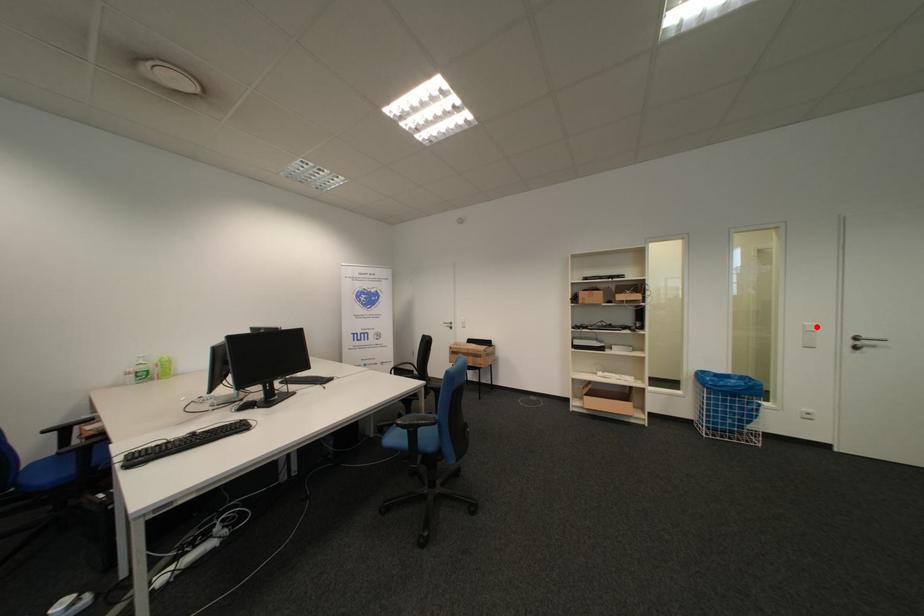
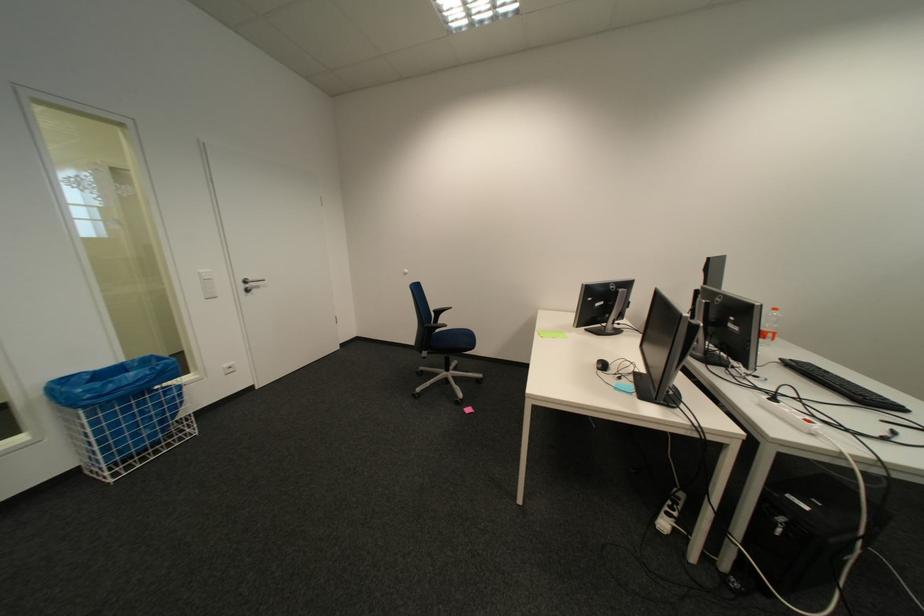
In the second image, find the point that corresponds to the highlighted location in the first image.

(212, 275)